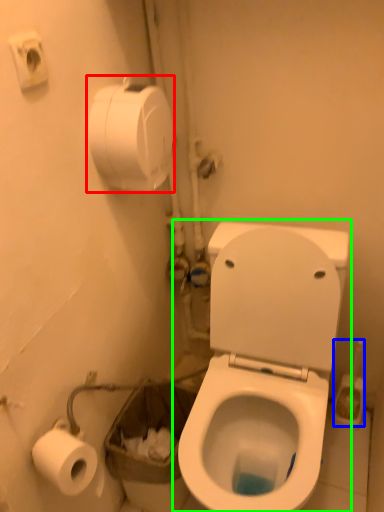
Question: Estimate the real-world distances between objects in this image. Which object is closer to toilet paper (highlighted by a red box), brush (highlighted by a blue box) or toilet (highlighted by a green box)?

Choices:
 (A) brush
 (B) toilet

Answer: (B)